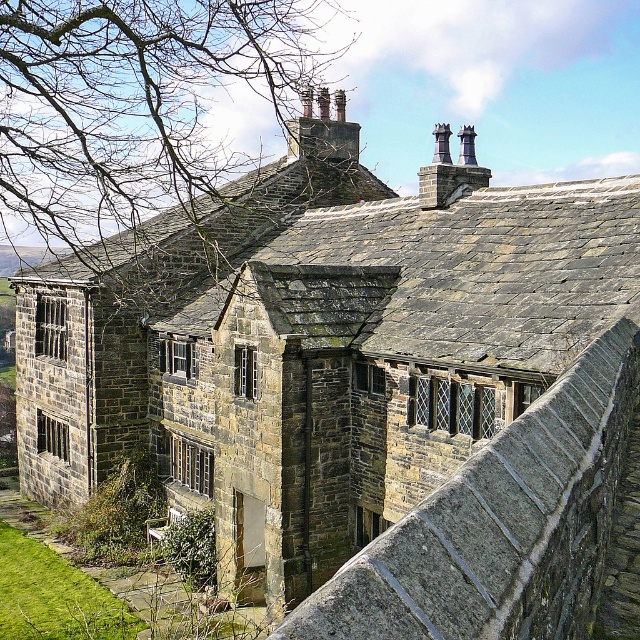
Is the position of bare branches at upper center more distant than that of stone ledge at upper center?

Yes, it is.

Is bare branches at upper center above stone ledge at upper center?

Yes.

Does point (170, 184) come farther from viewer compared to point (608, 337)?

Yes.

Find the location of a particular element. Image resolution: width=640 pixels, height=640 pixels. bare branches at upper center is located at coordinates (132, 100).

The height and width of the screenshot is (640, 640). What do you see at coordinates (500, 524) in the screenshot? I see `stone ledge at upper center` at bounding box center [500, 524].

Can you confirm if stone ledge at upper center is bigger than dark gray stone chimney at upper center?

No.

Is point (486, 608) positioned after point (436, 138)?

That is False.

The width and height of the screenshot is (640, 640). Identify the location of stone ledge at upper center. (500, 524).

Who is more distant from viewer, (99, 36) or (426, 179)?

Positioned behind is point (426, 179).

Which is in front, point (163, 22) or point (433, 132)?

Positioned in front is point (163, 22).

What do you see at coordinates (132, 100) in the screenshot?
I see `bare branches at upper center` at bounding box center [132, 100].

Where is `bare branches at upper center`? This screenshot has height=640, width=640. bare branches at upper center is located at coordinates [132, 100].